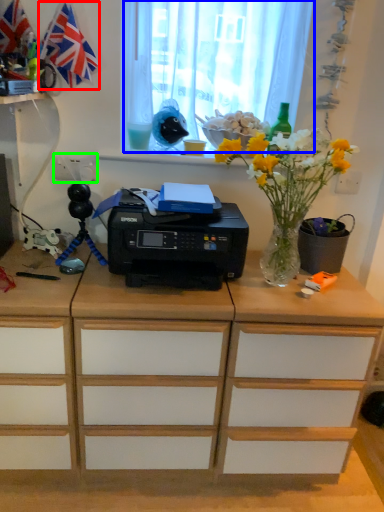
Question: Estimate the real-world distances between objects in this image. Which object is closer to flag (highlighted by a red box), curtain (highlighted by a blue box) or electric outlet (highlighted by a green box)?

Choices:
 (A) curtain
 (B) electric outlet

Answer: (B)